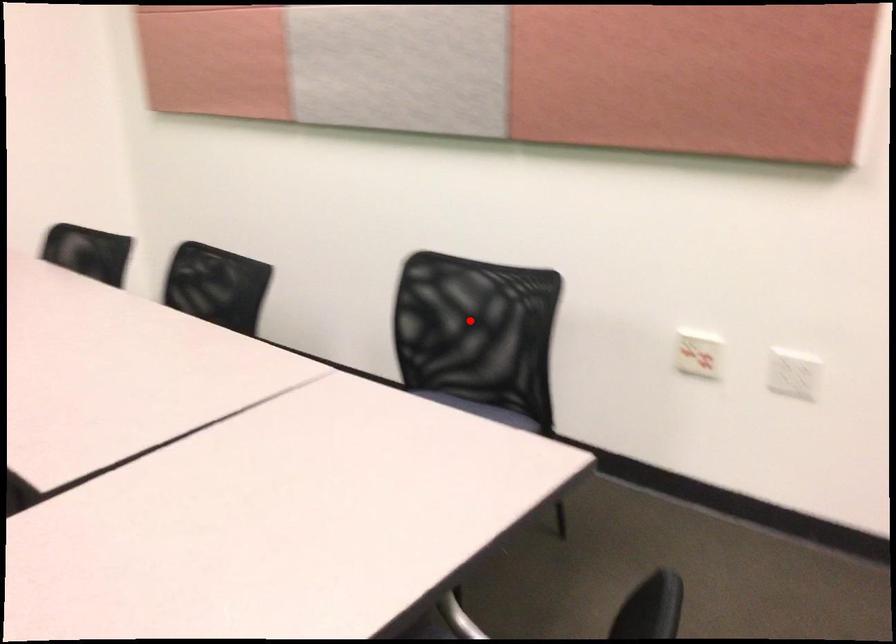
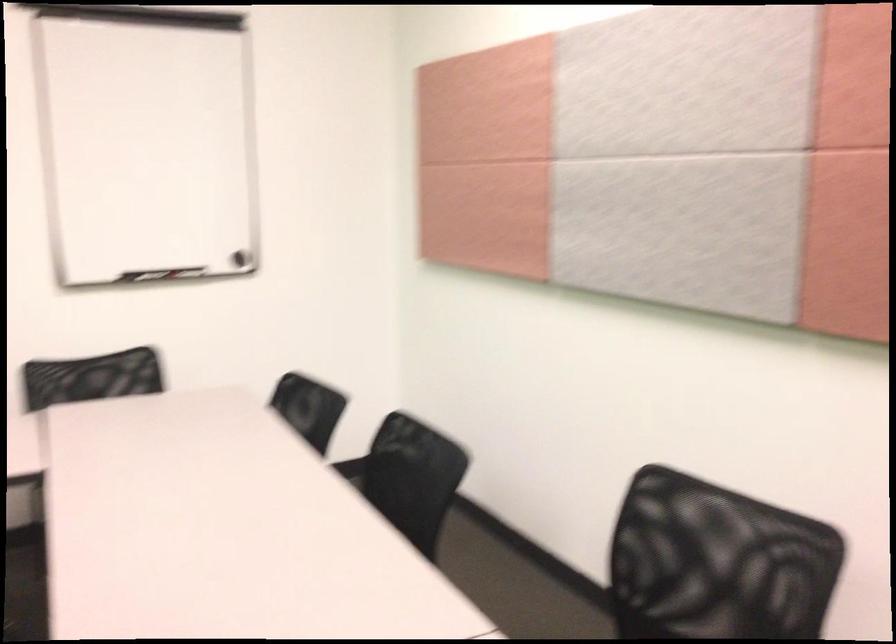
Question: I am providing you with two images of the same scene from different viewpoints. A red point is shown in image1. For the corresponding object point in image2, is it positioned nearer or farther from the camera?

Choices:
 (A) Nearer
 (B) Farther

Answer: (A)